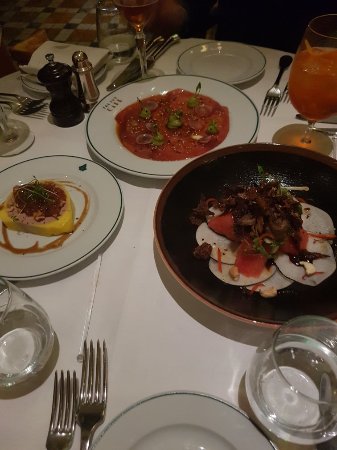
Where is `plate`? This screenshot has height=450, width=337. plate is located at coordinates (189, 430), (70, 237), (166, 122), (214, 56).